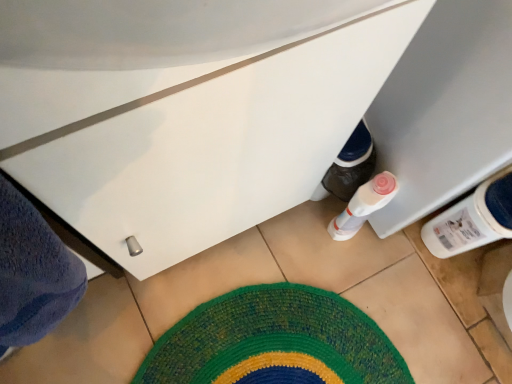
Question: Is white plastic bottle at lower right not inside multicolored woven mat at center?

Choices:
 (A) yes
 (B) no

Answer: (A)

Question: From a real-world perspective, is white plastic bottle at lower right physically below multicolored woven mat at center?

Choices:
 (A) no
 (B) yes

Answer: (A)

Question: Is white plastic bottle at lower right next to multicolored woven mat at center?

Choices:
 (A) no
 (B) yes

Answer: (A)

Question: Does white plastic bottle at lower right turn towards multicolored woven mat at center?

Choices:
 (A) no
 (B) yes

Answer: (B)

Question: Is white plastic bottle at lower right smaller than multicolored woven mat at center?

Choices:
 (A) yes
 (B) no

Answer: (B)

Question: Considering the positions of white glossy cabinet at lower center and white plastic bottle at lower right in the image, is white glossy cabinet at lower center taller or shorter than white plastic bottle at lower right?

Choices:
 (A) short
 (B) tall

Answer: (A)

Question: Is white glossy cabinet at lower center wider or thinner than white plastic bottle at lower right?

Choices:
 (A) wide
 (B) thin

Answer: (B)

Question: From the image's perspective, is white glossy cabinet at lower center positioned above or below white plastic bottle at lower right?

Choices:
 (A) above
 (B) below

Answer: (A)

Question: In terms of size, does white glossy cabinet at lower center appear bigger or smaller than white plastic bottle at lower right?

Choices:
 (A) small
 (B) big

Answer: (B)

Question: Is white plastic bottle at lower right in front of or behind white glossy cabinet at lower center in the image?

Choices:
 (A) behind
 (B) front

Answer: (A)

Question: Is white plastic bottle at lower right situated inside white glossy cabinet at lower center or outside?

Choices:
 (A) outside
 (B) inside

Answer: (A)

Question: Looking at their shapes, would you say white plastic bottle at lower right is wider or thinner than white glossy cabinet at lower center?

Choices:
 (A) thin
 (B) wide

Answer: (B)

Question: From a real-world perspective, is white plastic bottle at lower right above or below white glossy cabinet at lower center?

Choices:
 (A) above
 (B) below

Answer: (B)

Question: From a real-world perspective, is multicolored woven mat at center above or below white glossy cabinet at lower center?

Choices:
 (A) above
 (B) below

Answer: (B)

Question: Is multicolored woven mat at center taller or shorter than white glossy cabinet at lower center?

Choices:
 (A) short
 (B) tall

Answer: (A)